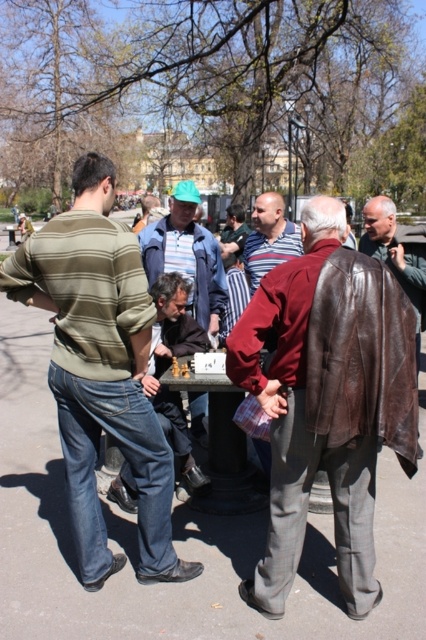
You are standing at the origin of the coordinate system. There is a point at coordinates point (187,256). What object is located at that point?

The point at coordinates point (187,256) marks the location of the matte green cap at center.

You are a photographer trying to capture a clear shot of the striped shirt at center and the matte green cap at center. Since you want both subjects to appear equally prominent in the photo, which object should you zoom in on more?

The matte green cap at center is larger than the striped shirt at center, so you should zoom in more on the striped shirt at center to balance their prominence in the photo.